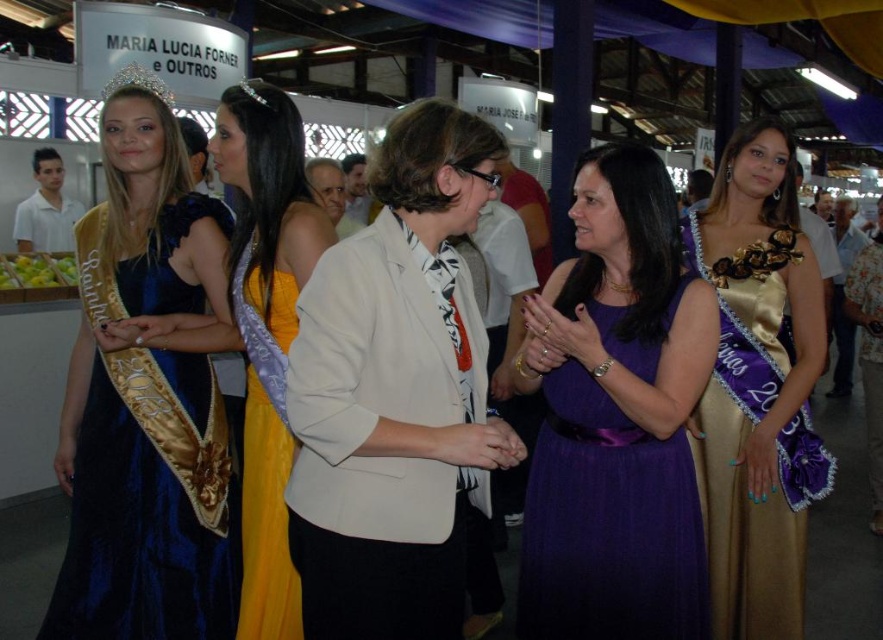
Is yellow satin dress at center positioned before gold shiny crown at upper left?

Yes, it is.

Is point (243, 620) closer to viewer compared to point (112, 92)?

Yes, it is.

Between point (270, 390) and point (153, 77), which one is positioned behind?

Point (153, 77)

Find the location of a particular element. The height and width of the screenshot is (640, 883). yellow satin dress at center is located at coordinates (265, 451).

Who is positioned more to the right, yellow satin dress at center or gold shiny tiara at upper left?

From the viewer's perspective, yellow satin dress at center appears more on the right side.

Between point (254, 381) and point (257, 84), which one is positioned in front?

Point (254, 381)

Where is `yellow satin dress at center`? This screenshot has height=640, width=883. yellow satin dress at center is located at coordinates (265, 451).

Identify the location of gold satin dress at right. The image size is (883, 640). (758, 388).

Is gold satin dress at right further to camera compared to gold shiny crown at upper left?

No.

Is point (710, 520) positioned behind point (159, 83)?

Yes.

The height and width of the screenshot is (640, 883). Find the location of `gold satin dress at right`. gold satin dress at right is located at coordinates (758, 388).